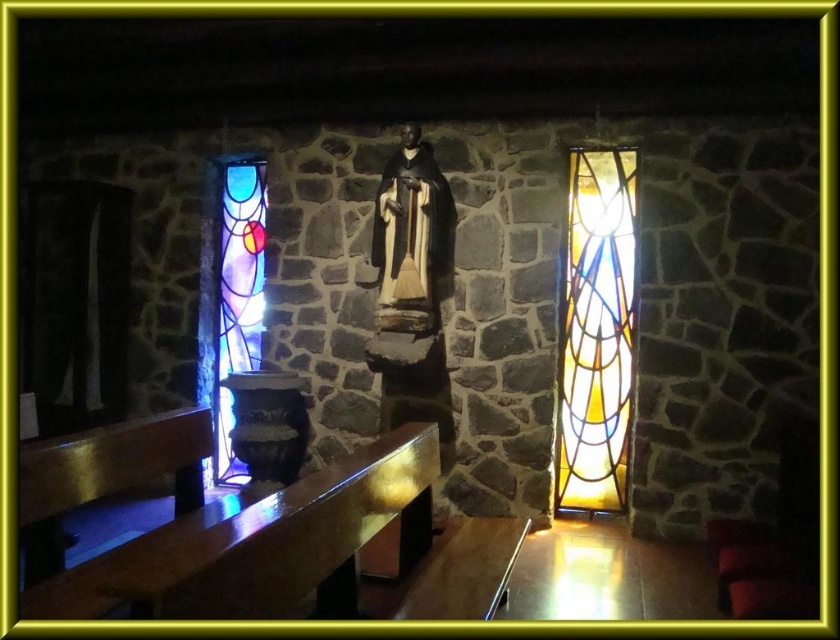
Question: Is polished wood bench at lower left wider than stained glass window at left?

Choices:
 (A) no
 (B) yes

Answer: (B)

Question: Which of the following is the farthest from the observer?

Choices:
 (A) polished wood bench at lower left
 (B) translucent stained glass at right

Answer: (B)

Question: Estimate the real-world distances between objects in this image. Which object is closer to the polished wood bench at lower left?

Choices:
 (A) stained glass window at left
 (B) translucent stained glass at right

Answer: (B)

Question: Is translucent stained glass at right in front of stained glass window at left?

Choices:
 (A) no
 (B) yes

Answer: (B)

Question: Can you confirm if polished wood bench at lower left is positioned to the left of translucent stained glass at right?

Choices:
 (A) yes
 (B) no

Answer: (A)

Question: Among these points, which one is farthest from the camera?

Choices:
 (A) (486, 524)
 (B) (617, 212)
 (C) (256, 307)

Answer: (C)